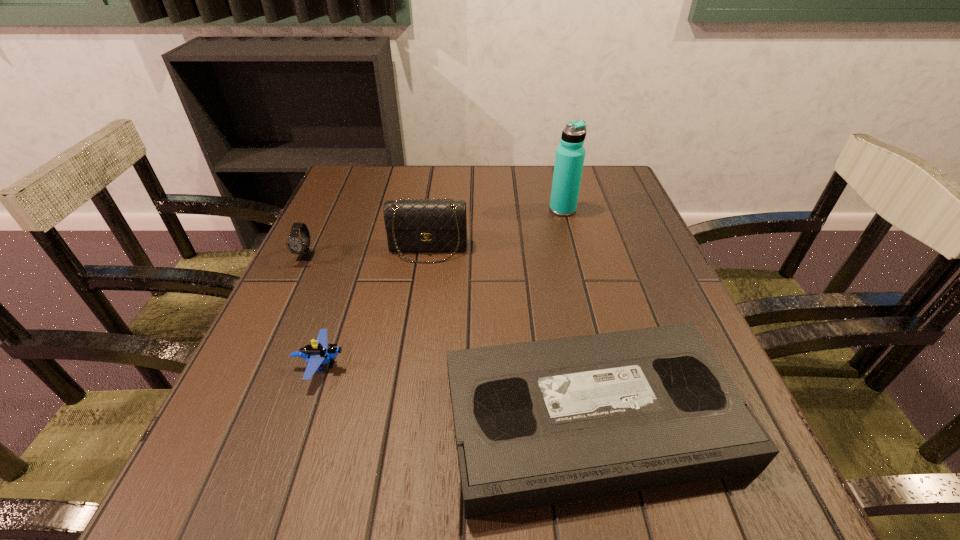
At what (x,y) coordinates should I click in order to perform the action: click on vacant space that satisfies the following two spatial constraints: 1. on the front-facing side of the fourth object from right to left; 2. on the right side of the shortest object. Please return your answer as a coordinate pair (x, y). Image resolution: width=960 pixels, height=540 pixels. Looking at the image, I should click on (303, 417).